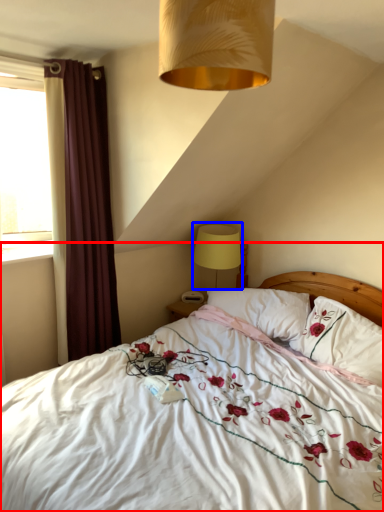
Question: Which object appears farthest to the camera in this image, bed (highlighted by a red box) or table lamp (highlighted by a blue box)?

Choices:
 (A) bed
 (B) table lamp

Answer: (B)